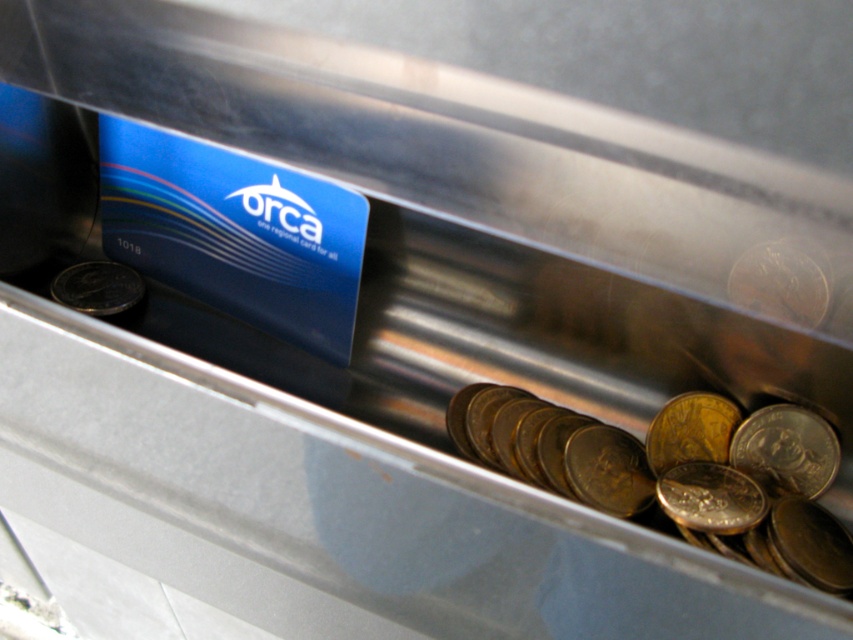
Measure the distance between silver metallic coin at lower right and camera.

silver metallic coin at lower right is 28.95 inches away from camera.

Is silver metallic coin at lower right wider than gold metallic coin at center?

Correct, the width of silver metallic coin at lower right exceeds that of gold metallic coin at center.

This screenshot has height=640, width=853. In order to click on silver metallic coin at lower right in this screenshot , I will do `click(786, 451)`.

Image resolution: width=853 pixels, height=640 pixels. In order to click on silver metallic coin at lower right in this screenshot , I will do `click(786, 451)`.

Who is shorter, gold metallic coins at center or gold metallic coin at center?

Standing shorter between the two is gold metallic coin at center.

From the picture: Does gold metallic coins at center have a greater height compared to gold metallic coin at center?

Yes, gold metallic coins at center is taller than gold metallic coin at center.

The height and width of the screenshot is (640, 853). I want to click on gold metallic coins at center, so click(677, 472).

Where is `gold metallic coins at center`? gold metallic coins at center is located at coordinates (677, 472).

Can you confirm if gold/yellow metallic coin at center-right is positioned above gold metallic coin at left?

No.

What do you see at coordinates (689, 429) in the screenshot? I see `gold/yellow metallic coin at center-right` at bounding box center [689, 429].

Image resolution: width=853 pixels, height=640 pixels. I want to click on gold/yellow metallic coin at center-right, so click(x=689, y=429).